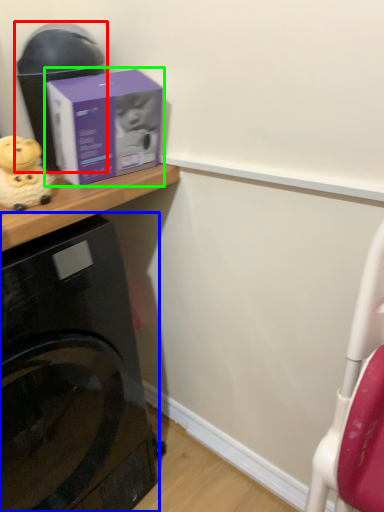
Question: Which object is the farthest from appliance (highlighted by a red box)? Choose among these: home appliance (highlighted by a blue box) or box (highlighted by a green box).

Choices:
 (A) home appliance
 (B) box

Answer: (A)